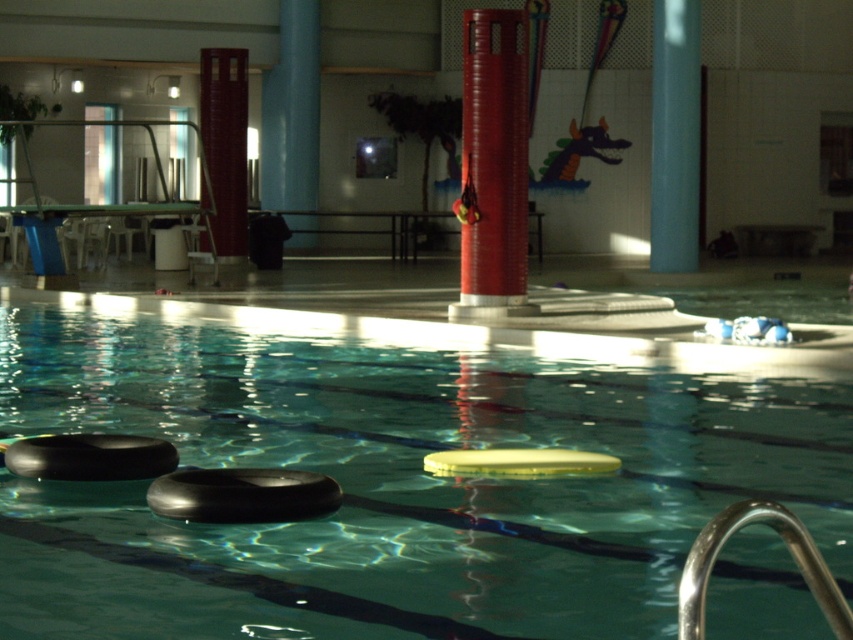
Question: Considering the real-world distances, which object is closest to the black rubber tire at lower left?

Choices:
 (A) blue glossy pole at upper center
 (B) black rubber tire at center
 (C) red matte column at center

Answer: (B)

Question: Does blue smooth pole at center appear over black rubber tire at lower left?

Choices:
 (A) no
 (B) yes

Answer: (B)

Question: Does red matte column at center have a greater width compared to black rubber tire at lower left?

Choices:
 (A) no
 (B) yes

Answer: (A)

Question: Which of these objects is positioned closest to the blue smooth pole at center?

Choices:
 (A) black rubber tire at lower left
 (B) blue glossy pole at upper center

Answer: (B)

Question: Does blue smooth pole at center lie in front of black rubber tire at center?

Choices:
 (A) no
 (B) yes

Answer: (A)

Question: Which point appears farthest from the camera in this image?

Choices:
 (A) (672, 272)
 (B) (294, 481)
 (C) (306, 134)
 (D) (38, 458)

Answer: (C)